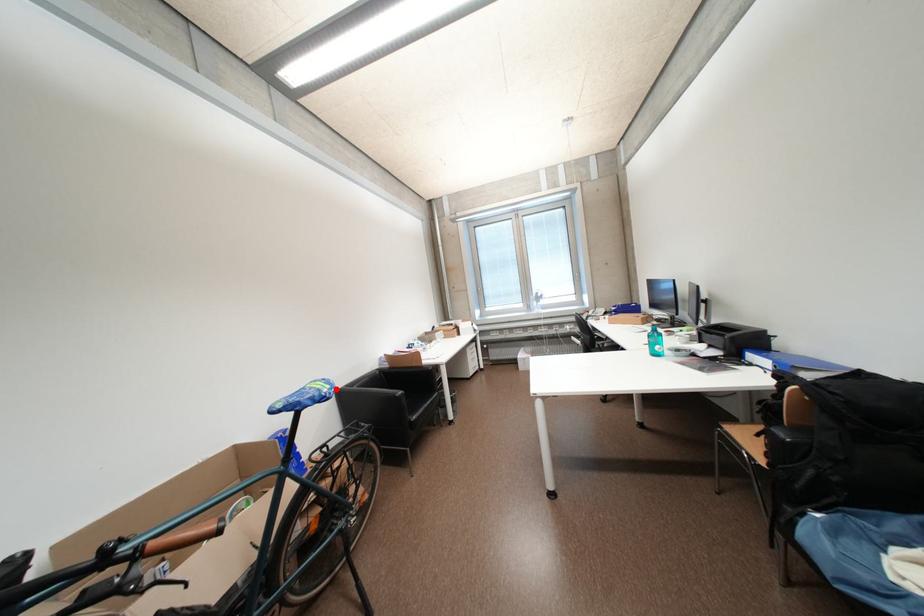
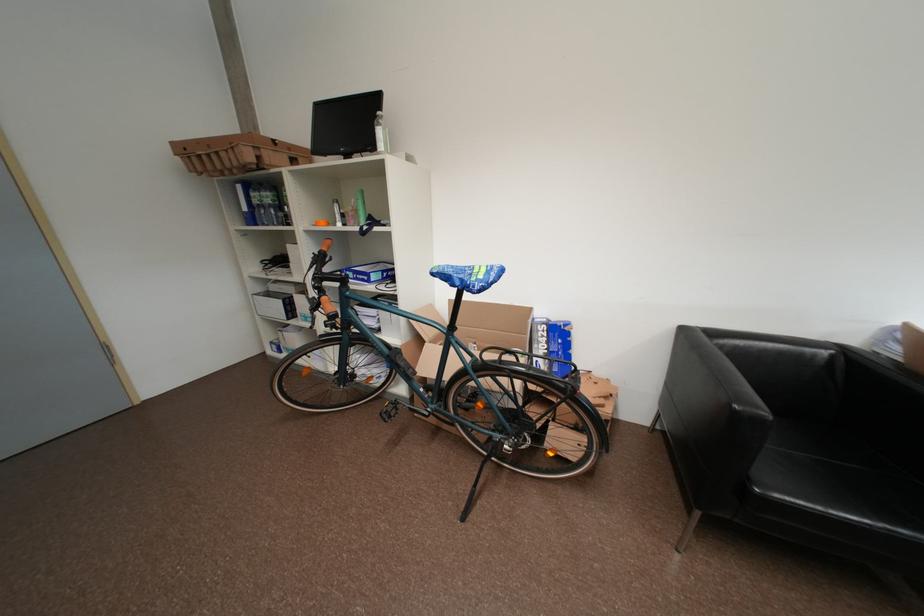
Question: I am providing you with two images of the same scene from different viewpoints. A red point is marked on the first image. Is the red point's position out of view in image 2?

Choices:
 (A) Yes
 (B) No

Answer: (B)